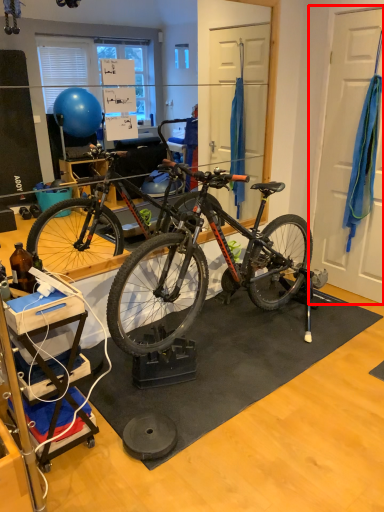
Question: Where is door (annotated by the red box) located in relation to doormat in the image?

Choices:
 (A) left
 (B) right

Answer: (B)